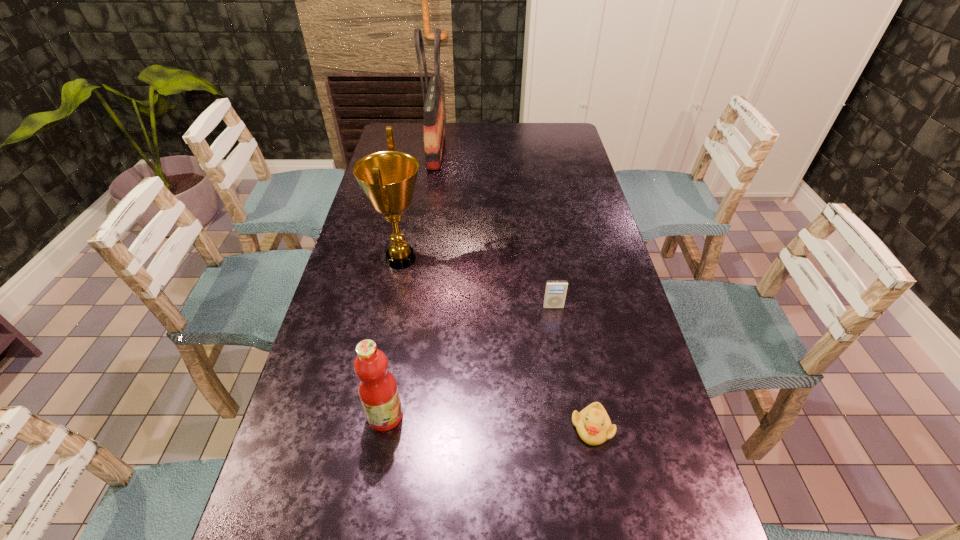
Find the location of `free area in between the award and the third farthest object`. free area in between the award and the third farthest object is located at coordinates (477, 283).

I want to click on empty space between the farthest object and the award, so click(x=419, y=205).

Image resolution: width=960 pixels, height=540 pixels. I want to click on free space between the fourth nearest object and the third nearest object, so click(x=477, y=283).

Locate an element on the screen. This screenshot has width=960, height=540. free area in between the second shortest object and the duckling is located at coordinates (572, 367).

Locate an element on the screen. This screenshot has width=960, height=540. vacant space in between the duckling and the second farthest object is located at coordinates (496, 343).

This screenshot has width=960, height=540. In order to click on vacant region between the second farthest object and the third tallest object in this screenshot , I will do `click(394, 338)`.

Select which object is the closest to the fruit juice. Please provide its 2D coordinates. Your answer should be formatted as a tuple, i.e. [(x, y)], where the tuple contains the x and y coordinates of a point satisfying the conditions above.

[(388, 178)]

Where is `the second closest object to the fourth shortest object`? The height and width of the screenshot is (540, 960). the second closest object to the fourth shortest object is located at coordinates (377, 388).